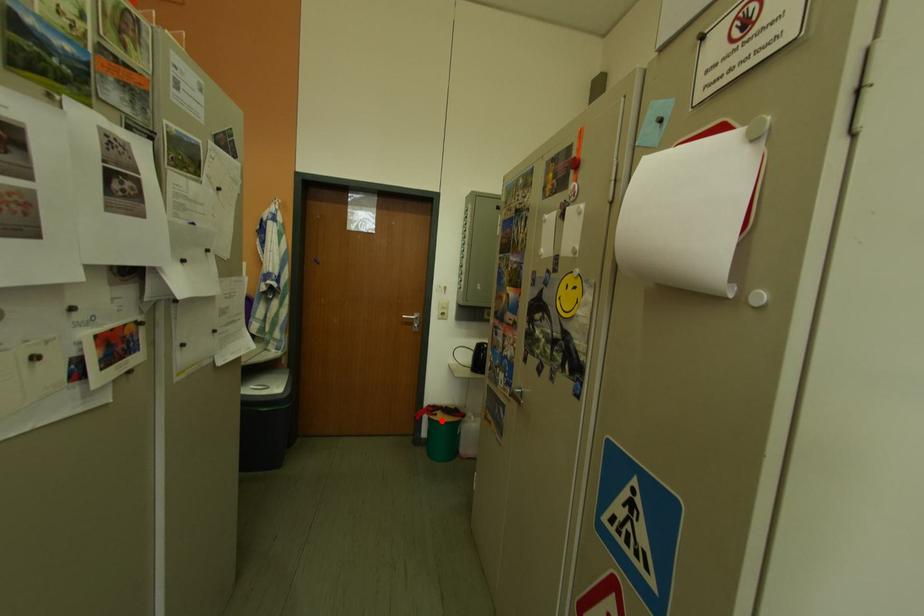
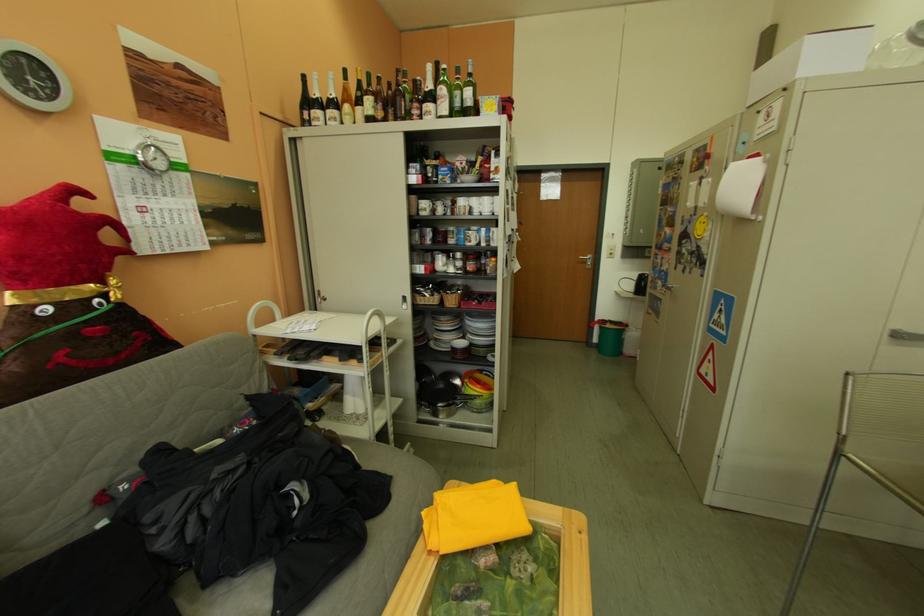
In the second image, find the point that corresponds to the highlighted location in the first image.

(613, 330)